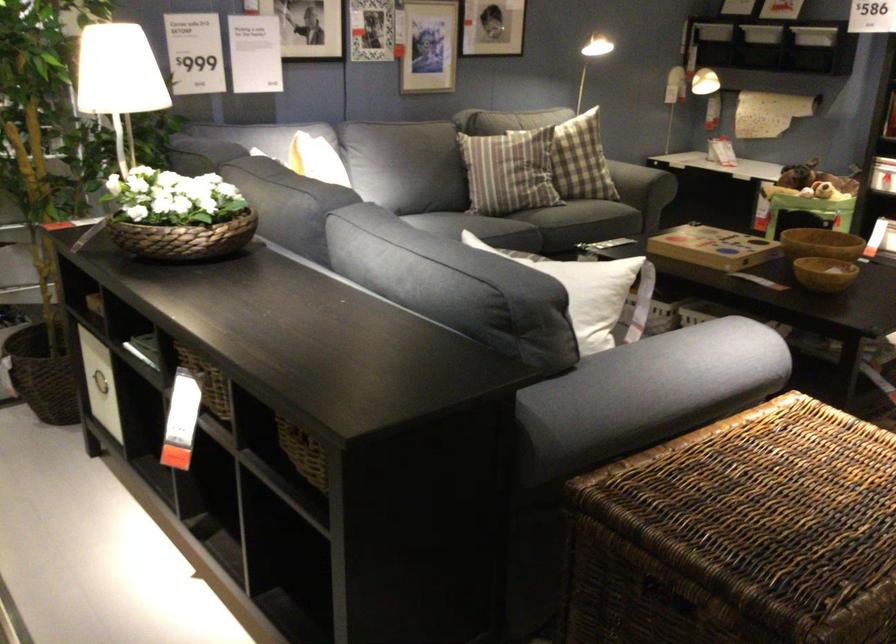
Where is `white pillow`? white pillow is located at coordinates (581, 272).